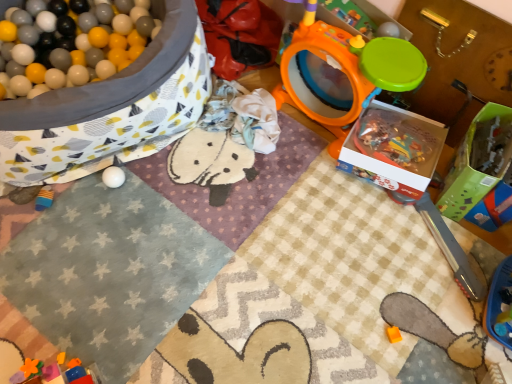
Question: Considering the positions of orange plastic drum at upper right, acting as the 1th toy starting from the top, and white matte ball at lower left, which is counted as the fourth toy, starting from the right, in the image, is orange plastic drum at upper right, acting as the 1th toy starting from the top, taller or shorter than white matte ball at lower left, which is counted as the fourth toy, starting from the right,?

Choices:
 (A) short
 (B) tall

Answer: (B)

Question: From a real-world perspective, is orange plastic drum at upper right, the third toy positioned from the right, positioned above or below white matte ball at lower left, which is counted as the fourth toy, starting from the right?

Choices:
 (A) below
 (B) above

Answer: (B)

Question: Which object is positioned farthest from the green cardboard box at right, which appears as the first box when viewed from the right?

Choices:
 (A) white cardboard box at center-right, the second box positioned from the right
 (B) orange plastic drum at upper right, arranged as the 4th toy when viewed from the left
 (C) blue rubber toy at lower left, placed as the 4th toy when sorted from top to bottom
 (D) white matte ball at lower left, positioned as the third toy in top-to-bottom order
 (E) translucent plastic toy at center, the first toy from the right

Answer: (C)

Question: Estimate the real-world distances between objects in this image. Which object is closer to the translucent plastic toy at center, the first toy from the right?

Choices:
 (A) blue rubber toy at lower left, which ranks as the 3th toy in bottom-to-top order
 (B) white textured blanket at upper left
 (C) orange matte toy at lower center, the 5th toy when ordered from top to bottom
 (D) orange plastic drum at upper right, acting as the 1th toy starting from the top
 (E) green cardboard box at right, which appears as the first box when viewed from the right

Answer: (E)